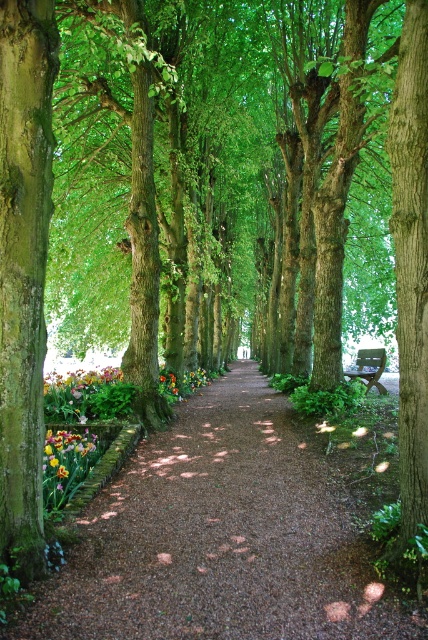
Question: Among these points, which one is nearest to the camera?

Choices:
 (A) (45, 432)
 (B) (376, 380)

Answer: (A)

Question: Considering the relative positions of brown gravel path at center and multicolored fabric flowers at center in the image provided, where is brown gravel path at center located with respect to multicolored fabric flowers at center?

Choices:
 (A) below
 (B) above

Answer: (A)

Question: Observing the image, what is the correct spatial positioning of brown gravel path at center in reference to wooden bench at center?

Choices:
 (A) left
 (B) right

Answer: (A)

Question: Does brown gravel path at center appear over multicolored fabric flowers at center?

Choices:
 (A) yes
 (B) no

Answer: (B)

Question: Which object is closer to the camera taking this photo?

Choices:
 (A) multicolored fabric flowers at center
 (B) wooden bench at center

Answer: (A)

Question: Which point is closer to the camera taking this photo?

Choices:
 (A) (68, 392)
 (B) (61, 593)
 (C) (359, 372)

Answer: (B)